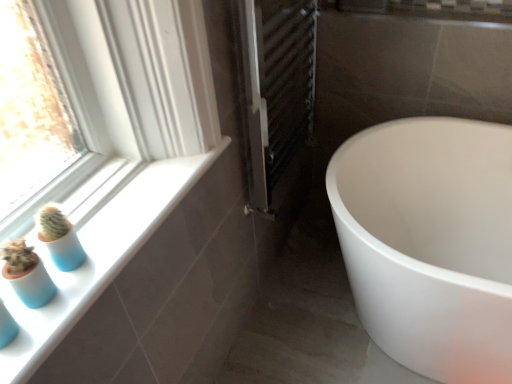
Image resolution: width=512 pixels, height=384 pixels. Describe the element at coordinates (32, 284) in the screenshot. I see `blue matte glass vase at lower left` at that location.

The width and height of the screenshot is (512, 384). What do you see at coordinates (98, 258) in the screenshot?
I see `white glossy window sill at lower left` at bounding box center [98, 258].

At what (x,y) coordinates should I click in order to perform the action: click on white glossy tub at lower right. Please return your answer as a coordinate pair (x, y). Image resolution: width=512 pixels, height=384 pixels. Looking at the image, I should click on (430, 243).

Image resolution: width=512 pixels, height=384 pixels. Identify the location of blue matte glass vase at lower left. (32, 284).

Considering the relative sizes of blue matte glass vase at lower left and white glossy window sill at lower left in the image provided, is blue matte glass vase at lower left taller than white glossy window sill at lower left?

Indeed, blue matte glass vase at lower left has a greater height compared to white glossy window sill at lower left.

Is blue matte glass vase at lower left oriented away from white glossy window sill at lower left?

That's not correct — blue matte glass vase at lower left is not looking away from white glossy window sill at lower left.

Considering the relative positions of blue matte glass vase at lower left and white glossy window sill at lower left in the image provided, is blue matte glass vase at lower left to the right of white glossy window sill at lower left from the viewer's perspective?

Incorrect, blue matte glass vase at lower left is not on the right side of white glossy window sill at lower left.

At what (x,y) coordinates should I click in order to perform the action: click on glass vase below the white glossy window sill at lower left (from the image's perspective). Please return your answer as a coordinate pair (x, y). Looking at the image, I should click on (32, 284).

From the picture: From the image's perspective, who appears lower, blue matte glass vase at lower left or metallic silver radiator at center?

blue matte glass vase at lower left.

Between point (10, 274) and point (307, 67), which one is positioned in front?

Positioned in front is point (10, 274).

From a real-world perspective, is blue matte glass vase at lower left positioned above or below metallic silver radiator at center?

In terms of real-world spatial position, blue matte glass vase at lower left is above metallic silver radiator at center.

Can you confirm if blue matte glass vase at lower left is smaller than metallic silver radiator at center?

Correct, blue matte glass vase at lower left occupies less space than metallic silver radiator at center.

Is white glossy window sill at lower left facing towards blue matte glass vase at lower left?

No, white glossy window sill at lower left is not oriented towards blue matte glass vase at lower left.

Considering the sizes of objects white glossy window sill at lower left and blue matte glass vase at lower left in the image provided, who is wider, white glossy window sill at lower left or blue matte glass vase at lower left?

With larger width is white glossy window sill at lower left.

Who is shorter, white glossy window sill at lower left or blue matte glass vase at lower left?

Standing shorter between the two is white glossy window sill at lower left.

Identify the location of window sill above the blue matte glass vase at lower left (from the image's perspective). The image size is (512, 384). (98, 258).

Does metallic silver radiator at center turn towards white glossy window sill at lower left?

No, metallic silver radiator at center is not turned towards white glossy window sill at lower left.

Can you confirm if metallic silver radiator at center is taller than white glossy window sill at lower left?

Indeed, metallic silver radiator at center has a greater height compared to white glossy window sill at lower left.

Is metallic silver radiator at center wider than white glossy window sill at lower left?

In fact, metallic silver radiator at center might be narrower than white glossy window sill at lower left.

What are the coordinates of `window sill below the metallic silver radiator at center (from the image's perspective)` in the screenshot? It's located at (98, 258).

Choose the correct answer: Is white glossy window sill at lower left inside white glossy tub at lower right or outside it?

The correct answer is: outside.

From a real-world perspective, which is physically below, white glossy window sill at lower left or white glossy tub at lower right?

white glossy tub at lower right is physically lower.

Does white glossy window sill at lower left have a smaller size compared to white glossy tub at lower right?

Yes, white glossy window sill at lower left is smaller than white glossy tub at lower right.

How far apart are white glossy window sill at lower left and white glossy tub at lower right?

They are 30.69 inches apart.

Is point (162, 203) positioned behind point (270, 48)?

No.

Is white glossy window sill at lower left behind metallic silver radiator at center?

No, the depth of white glossy window sill at lower left is less than that of metallic silver radiator at center.

Which is more to the left, white glossy window sill at lower left or metallic silver radiator at center?

white glossy window sill at lower left.

From the picture: Considering the sizes of objects white glossy window sill at lower left and metallic silver radiator at center in the image provided, who is thinner, white glossy window sill at lower left or metallic silver radiator at center?

With smaller width is metallic silver radiator at center.

Based on the photo, considering the sizes of objects metallic silver radiator at center and blue matte glass vase at lower left in the image provided, who is taller, metallic silver radiator at center or blue matte glass vase at lower left?

metallic silver radiator at center is taller.

From a real-world perspective, is metallic silver radiator at center over blue matte glass vase at lower left?

No, from a real-world perspective, metallic silver radiator at center is not above blue matte glass vase at lower left.

Is point (284, 146) positioned behind point (19, 285)?

That is True.

I want to click on glass vase located below the white glossy window sill at lower left (from the image's perspective), so click(x=32, y=284).

At what (x,y) coordinates should I click in order to perform the action: click on screen door above the blue matte glass vase at lower left (from the image's perspective). Please return your answer as a coordinate pair (x, y). This screenshot has height=384, width=512. Looking at the image, I should click on [x=276, y=86].

Considering their positions, is blue matte glass vase at lower left positioned further to white glossy window sill at lower left than metallic silver radiator at center?

The object further to white glossy window sill at lower left is metallic silver radiator at center.

From the image, which object appears to be nearer to blue matte glass vase at lower left, white glossy tub at lower right or metallic silver radiator at center?

Among the two, metallic silver radiator at center is located nearer to blue matte glass vase at lower left.

Estimate the real-world distances between objects in this image. Which object is further from white glossy tub at lower right, white glossy window sill at lower left or metallic silver radiator at center?

The object further to white glossy tub at lower right is white glossy window sill at lower left.

Which object lies nearer to the anchor point metallic silver radiator at center, white glossy tub at lower right or white glossy window sill at lower left?

white glossy tub at lower right.

Considering their positions, is blue matte glass vase at lower left positioned further to metallic silver radiator at center than white glossy window sill at lower left?

blue matte glass vase at lower left is positioned further to the anchor metallic silver radiator at center.

When comparing their distances from metallic silver radiator at center, does white glossy tub at lower right or blue matte glass vase at lower left seem closer?

→ white glossy tub at lower right.

In the scene shown: Which object lies further to the anchor point metallic silver radiator at center, blue matte glass vase at lower left or white glossy tub at lower right?

blue matte glass vase at lower left.

From the image, which object appears to be nearer to blue matte glass vase at lower left, white glossy window sill at lower left or metallic silver radiator at center?

white glossy window sill at lower left is closer to blue matte glass vase at lower left.

Identify the location of screen door between blue matte glass vase at lower left and white glossy tub at lower right. This screenshot has height=384, width=512. (276, 86).

In order to click on window sill between blue matte glass vase at lower left and white glossy tub at lower right in this screenshot , I will do `click(98, 258)`.

Where is `window sill between blue matte glass vase at lower left and metallic silver radiator at center from left to right`? The width and height of the screenshot is (512, 384). window sill between blue matte glass vase at lower left and metallic silver radiator at center from left to right is located at coordinates (98, 258).

The height and width of the screenshot is (384, 512). I want to click on screen door between white glossy window sill at lower left and white glossy tub at lower right from left to right, so click(x=276, y=86).